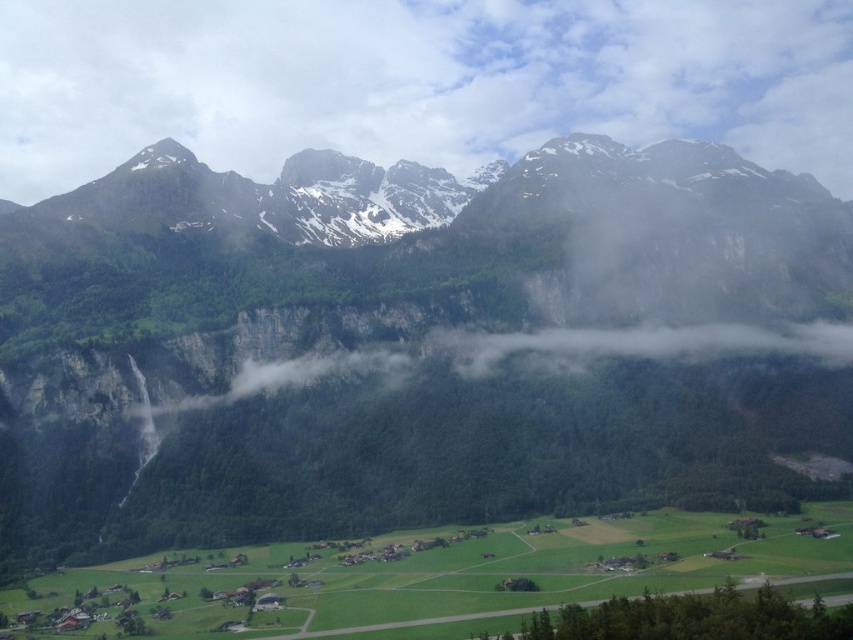
You are a photographer standing at the edge of the valley. You want to capture a photo that includes both the point at coordinates point (x=660, y=204) and point (x=196, y=80). Which point will appear larger in your photo?

Point (x=660, y=204) is closer to the camera than point (x=196, y=80), so it will appear larger in the photo.

Based on the scene description, what is the location of the point at coordinates (412, 346)?

The point at coordinates (412, 346) corresponds to the green rocky mountain range at upper center.

You are a drone operator who needs to fly a drone between the green rocky mountain range at upper center and the white fluffy cloud at upper center. The drone has a maximum flight range of 150 meters. Can the drone safely complete the flight without exceeding its range?

The distance between the green rocky mountain range at upper center and the white fluffy cloud at upper center is 152.02 meters, which exceeds the drone operator has a maximum flight range of 150 meters. The drone cannot safely complete the flight without exceeding its range.